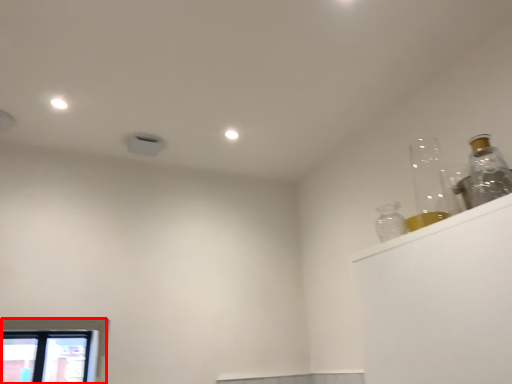
Question: Observing the image, what is the correct spatial positioning of window (annotated by the red box) in reference to bottle?

Choices:
 (A) right
 (B) left

Answer: (B)